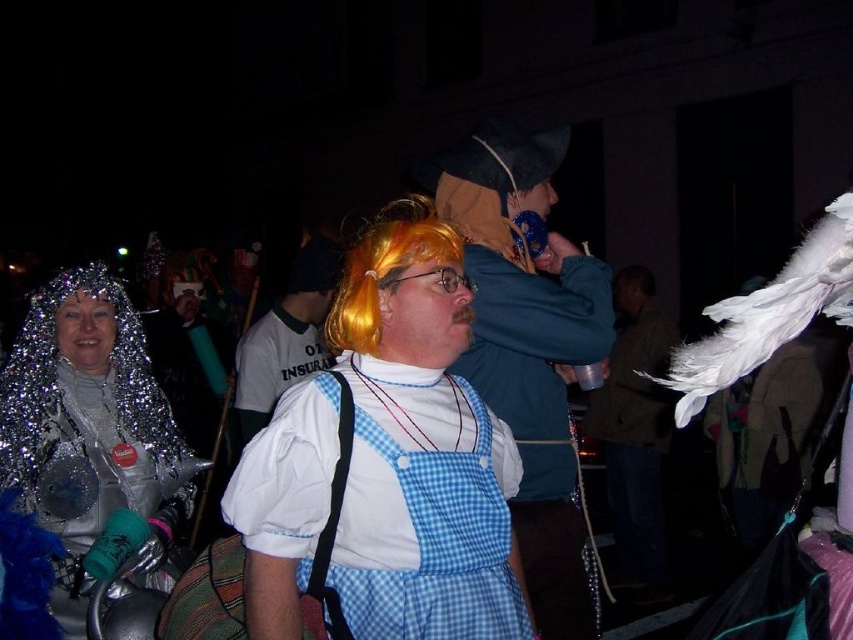
You are taking a photo of the scene and want to focus on both the point at point (372, 593) and the point at point (354, 278). Which point should you adjust your focus to first to ensure both are in focus?

You should focus on point (354, 278) first because it is farther from the camera than point (372, 593). By focusing on the farther point, the depth of field may include the closer point as well.

You are a photographer at the event and want to capture both the sparkly silver headpiece at upper left and the orange synthetic wig at center in a single frame. Which object should you focus on first to ensure both are in the frame?

The sparkly silver headpiece at upper left is taller than the orange synthetic wig at center, so you should focus on the sparkly silver headpiece at upper left first to ensure both are in the frame.